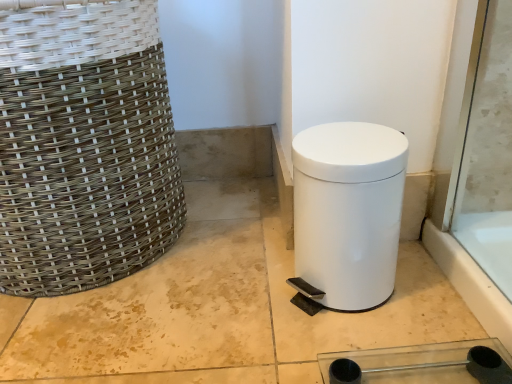
Question: Does white glossy trash can at lower right have a larger size compared to white woven basket at left?

Choices:
 (A) no
 (B) yes

Answer: (A)

Question: From the image's perspective, is white glossy trash can at lower right under white woven basket at left?

Choices:
 (A) yes
 (B) no

Answer: (A)

Question: Is white glossy trash can at lower right touching white woven basket at left?

Choices:
 (A) no
 (B) yes

Answer: (A)

Question: Is white glossy trash can at lower right further to the viewer compared to white woven basket at left?

Choices:
 (A) no
 (B) yes

Answer: (B)

Question: Can you confirm if white glossy trash can at lower right is shorter than white woven basket at left?

Choices:
 (A) yes
 (B) no

Answer: (A)

Question: From a real-world perspective, is white glossy trash can at lower right on top of white woven basket at left?

Choices:
 (A) no
 (B) yes

Answer: (A)

Question: Is white woven basket at left closer to camera compared to white glossy trash can at lower right?

Choices:
 (A) yes
 (B) no

Answer: (A)

Question: Can you confirm if white woven basket at left is thinner than white glossy trash can at lower right?

Choices:
 (A) yes
 (B) no

Answer: (B)

Question: Could you tell me if white woven basket at left is turned towards white glossy trash can at lower right?

Choices:
 (A) no
 (B) yes

Answer: (A)

Question: Considering the relative sizes of white woven basket at left and white glossy trash can at lower right in the image provided, is white woven basket at left bigger than white glossy trash can at lower right?

Choices:
 (A) yes
 (B) no

Answer: (A)

Question: From the image's perspective, does white woven basket at left appear higher than white glossy trash can at lower right?

Choices:
 (A) yes
 (B) no

Answer: (A)

Question: Are white woven basket at left and white glossy trash can at lower right beside each other?

Choices:
 (A) yes
 (B) no

Answer: (B)

Question: In terms of height, does white glossy trash can at lower right look taller or shorter compared to white woven basket at left?

Choices:
 (A) tall
 (B) short

Answer: (B)